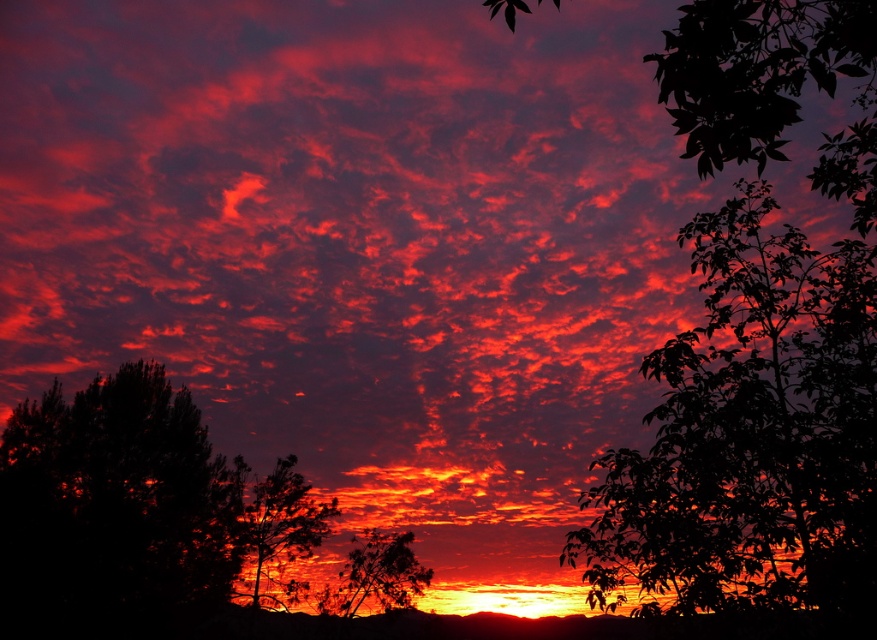
In the sunset scene with the vibrant red, orange, and purple sky, there is a point labeled as point (165, 525). Based on the scene description, what does this point most likely represent?

The point (165, 525) most likely represents the silhouette tree at center as described in the scene.

You are standing in front of the sunset scene. You notice two points marked on the image at coordinates point (x=275, y=464) and point (x=275, y=500). Which point is closer to you?

Point (x=275, y=500) is closer to you because point (x=275, y=464) is behind it.